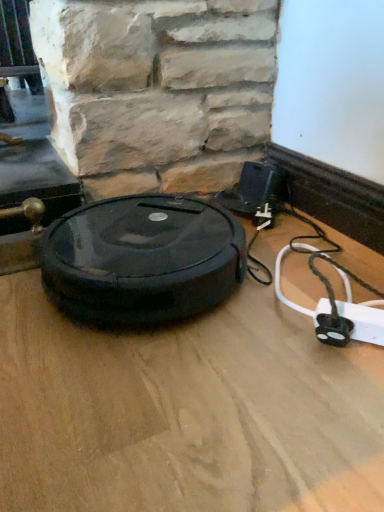
At what (x,y) coordinates should I click in order to perform the action: click on vacant area that lies between black rubber robot vacuum cleaner at center and white plastic extension cord at lower right. Please return your answer as a coordinate pair (x, y). Looking at the image, I should click on (250, 328).